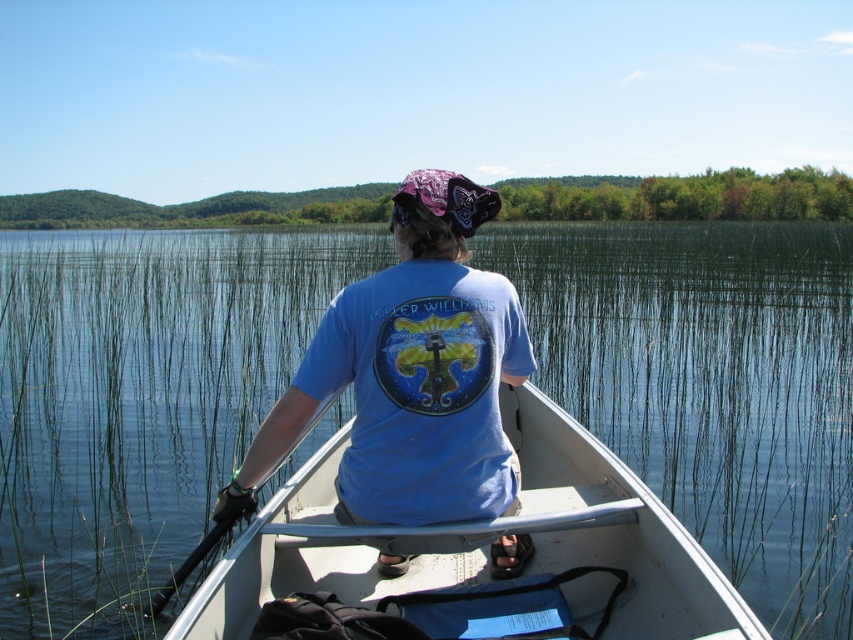
Is blue cotton shirt at center above white plastic boat at center?

Correct, blue cotton shirt at center is located above white plastic boat at center.

I want to click on blue cotton shirt at center, so click(412, 372).

Which is in front, point (332, 352) or point (589, 515)?

Point (332, 352) is more forward.

Where is `blue cotton shirt at center`? This screenshot has height=640, width=853. blue cotton shirt at center is located at coordinates (412, 372).

Is clear water at center shorter than white plastic boat at center?

In fact, clear water at center may be taller than white plastic boat at center.

Does clear water at center have a greater width compared to white plastic boat at center?

Yes.

Between point (566, 371) and point (511, 388), which one is positioned in front?

Positioned in front is point (511, 388).

Image resolution: width=853 pixels, height=640 pixels. Find the location of `clear water at center`. clear water at center is located at coordinates (138, 400).

Between clear water at center and blue cotton shirt at center, which one is positioned lower?

blue cotton shirt at center

Between clear water at center and blue cotton shirt at center, which one has less height?

blue cotton shirt at center

In the scene shown: Who is more forward, (225, 292) or (242, 476)?

Positioned in front is point (242, 476).

Where is `clear water at center`? This screenshot has width=853, height=640. clear water at center is located at coordinates (138, 400).